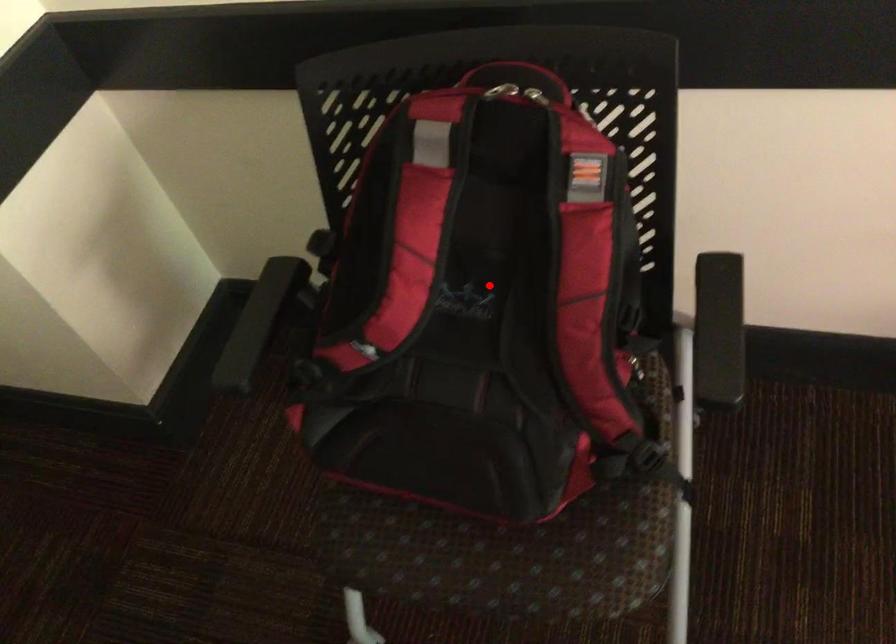
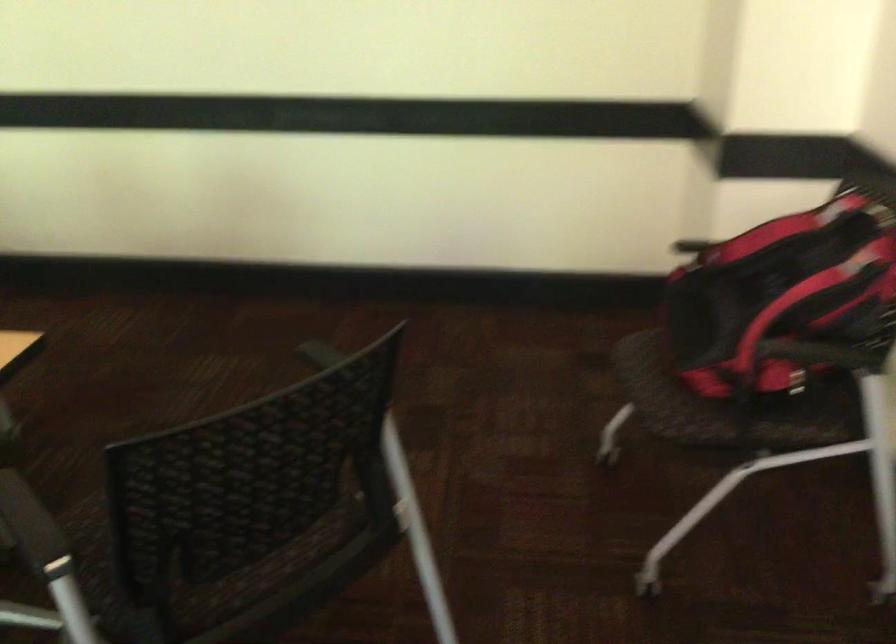
Find the pixel in the second image that matches the highlighted location in the first image.

(785, 283)